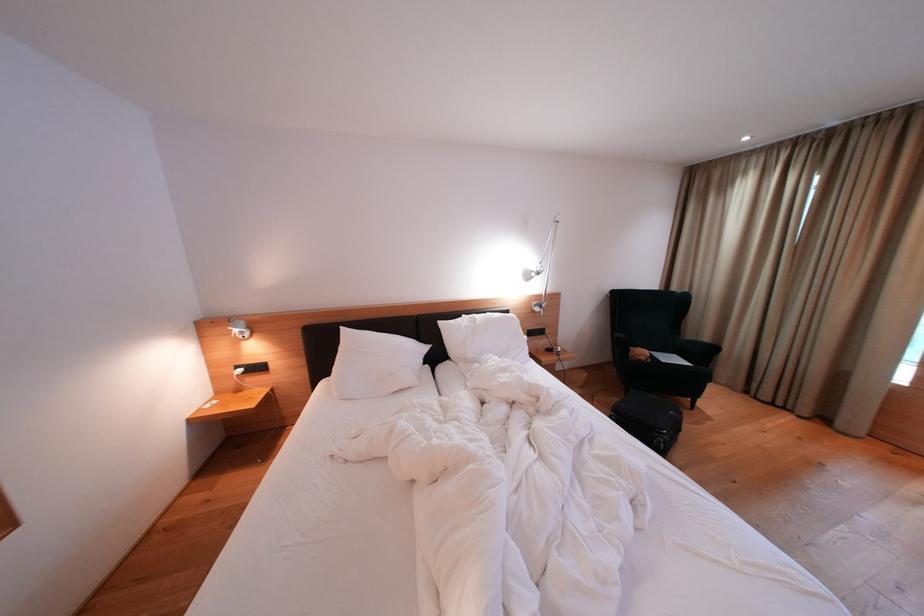
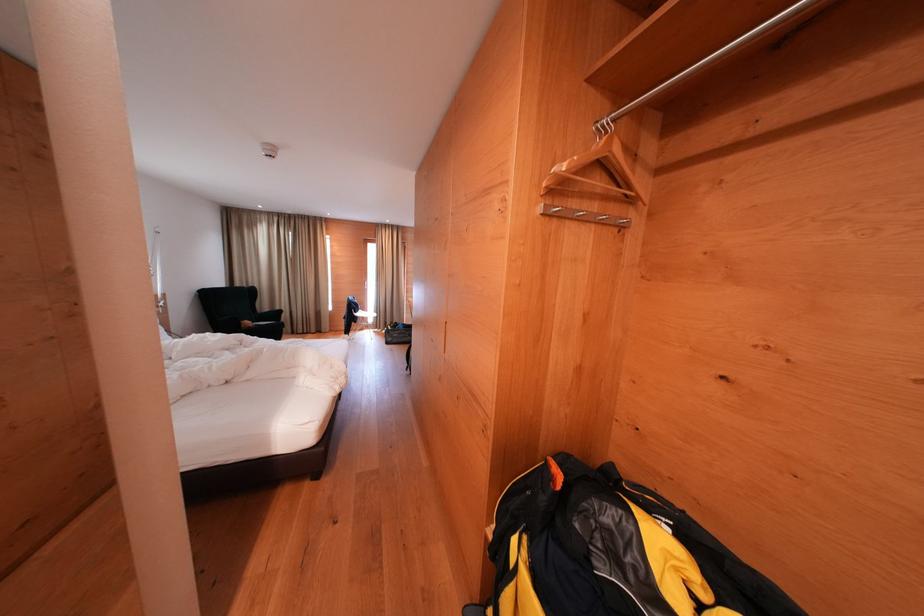
Locate, in the second image, the point that corresponds to point 636,355 in the first image.

(247, 329)